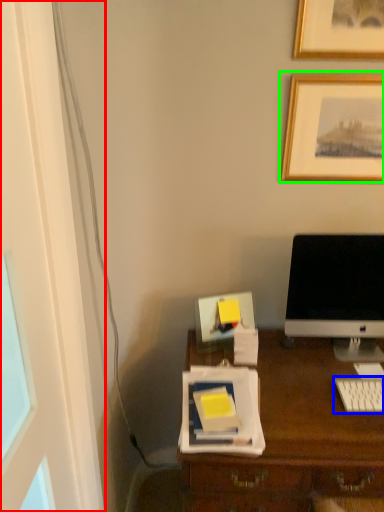
Question: Which object is the farthest from glass door (highlighted by a red box)? Choose among these: computer keyboard (highlighted by a blue box) or picture frame (highlighted by a green box).

Choices:
 (A) computer keyboard
 (B) picture frame

Answer: (B)